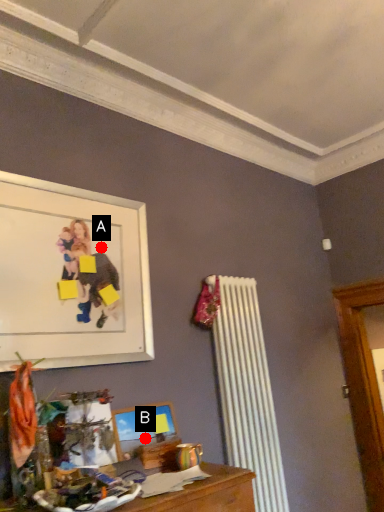
Question: Two points are circled on the image, labeled by A and B beside each circle. Which point is closer to the camera?

Choices:
 (A) A is closer
 (B) B is closer

Answer: (B)